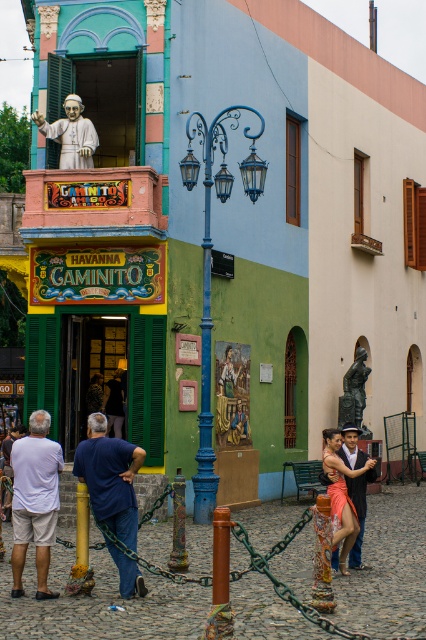
Question: In this image, where is matte pink dress at center located relative to bronze statue at center?

Choices:
 (A) above
 (B) below

Answer: (B)

Question: Estimate the real-world distances between objects in this image. Which object is farther from the brushed metal pole at center?

Choices:
 (A) blue cotton shirt at lower left
 (B) bronze statue at center
 (C) metallic pole at center

Answer: (B)

Question: Can you confirm if white cotton shirt at lower left is smaller than blue cotton shirt at lower left?

Choices:
 (A) no
 (B) yes

Answer: (B)

Question: Which point is closer to the camera taking this photo?

Choices:
 (A) (348, 417)
 (B) (178, 496)
 (C) (63, 118)
 (D) (140, 573)

Answer: (D)

Question: Considering the relative positions of blue cotton shirt at lower left and metallic pole at center in the image provided, where is blue cotton shirt at lower left located with respect to metallic pole at center?

Choices:
 (A) left
 (B) right

Answer: (A)

Question: Based on their relative distances, which object is farther from the metallic pole at center?

Choices:
 (A) bronze statue at center
 (B) brushed metal pole at center
 (C) matte pink dress at center

Answer: (A)